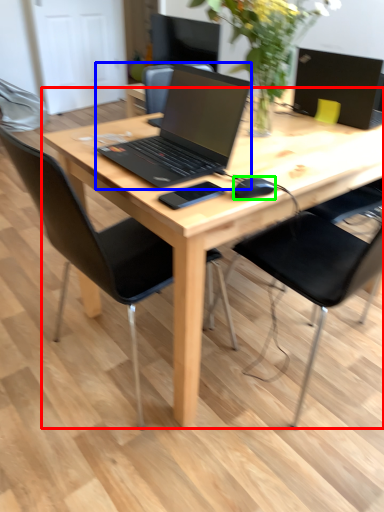
Question: Which object is positioned closest to desk (highlighted by a red box)? Select from laptop (highlighted by a blue box) and mouse (highlighted by a green box).

Choices:
 (A) laptop
 (B) mouse

Answer: (A)